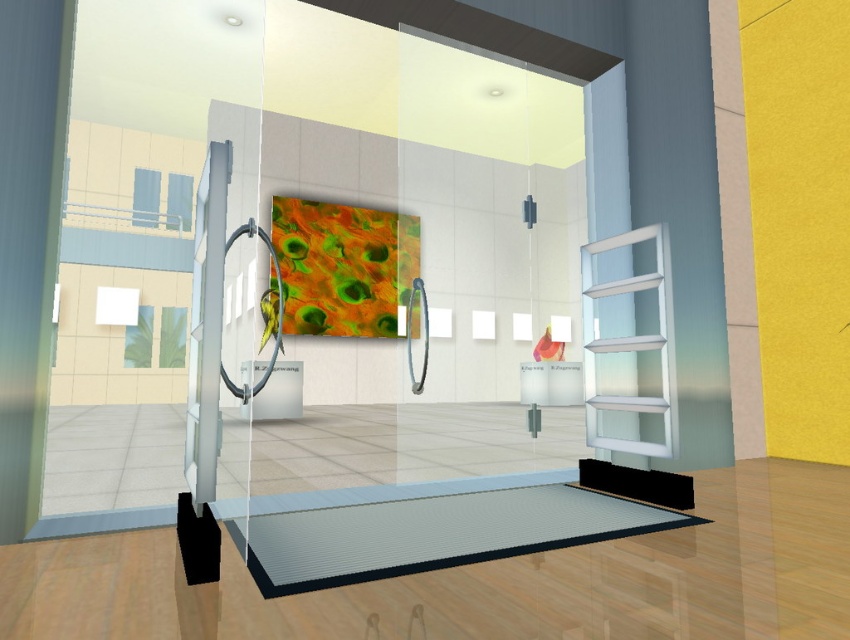
Can you confirm if transparent frosted glass at right is shorter than black rubber yoga mat at lower right?

In fact, transparent frosted glass at right may be taller than black rubber yoga mat at lower right.

Which is in front, point (585, 346) or point (599, 483)?

Point (599, 483) is more forward.

Does point (669, 292) come in front of point (625, 496)?

Yes, point (669, 292) is closer to viewer.

This screenshot has height=640, width=850. What are the coordinates of `transparent frosted glass at right` in the screenshot? It's located at (632, 342).

Is point (405, 488) closer to viewer compared to point (599, 288)?

Yes, it is in front of point (599, 288).

Does metallic gray mat at lower center have a greater width compared to transparent frosted glass at right?

Yes, metallic gray mat at lower center is wider than transparent frosted glass at right.

Between point (408, 516) and point (660, 243), which one is positioned in front?

Positioned in front is point (408, 516).

Where is `metallic gray mat at lower center`? The width and height of the screenshot is (850, 640). metallic gray mat at lower center is located at coordinates pyautogui.click(x=429, y=531).

Can you confirm if metallic gray mat at lower center is thinner than black rubber yoga mat at lower right?

In fact, metallic gray mat at lower center might be wider than black rubber yoga mat at lower right.

Is metallic gray mat at lower center taller than black rubber yoga mat at lower right?

No.

What do you see at coordinates (429, 531) in the screenshot?
I see `metallic gray mat at lower center` at bounding box center [429, 531].

Identify the location of metallic gray mat at lower center. This screenshot has width=850, height=640. (429, 531).